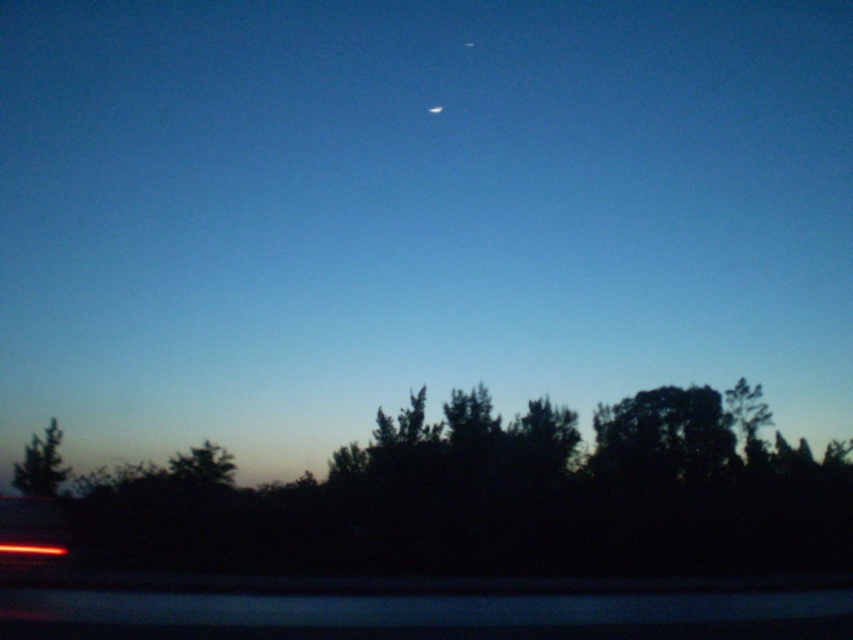
Question: Can you confirm if green matte tree at lower left is thinner than white glossy moon at upper center?

Choices:
 (A) no
 (B) yes

Answer: (A)

Question: Which of the following is the closest to the observer?

Choices:
 (A) white glossy moon at upper center
 (B) silhouette leafy tree at lower center

Answer: (B)

Question: Observing the image, what is the correct spatial positioning of silhouette leafy tree at lower center in reference to white glossy moon at upper center?

Choices:
 (A) right
 (B) left

Answer: (A)

Question: Estimate the real-world distances between objects in this image. Which object is farther from the white glossy moon at upper center?

Choices:
 (A) silhouette leafy tree at lower center
 (B) green matte tree at lower left

Answer: (A)

Question: Considering the relative positions of green matte tree at lower left and white glossy moon at upper center in the image provided, where is green matte tree at lower left located with respect to white glossy moon at upper center?

Choices:
 (A) below
 (B) above

Answer: (A)

Question: Which of these objects is positioned farthest from the white glossy moon at upper center?

Choices:
 (A) silhouette leafy tree at lower center
 (B) green matte tree at lower left

Answer: (A)